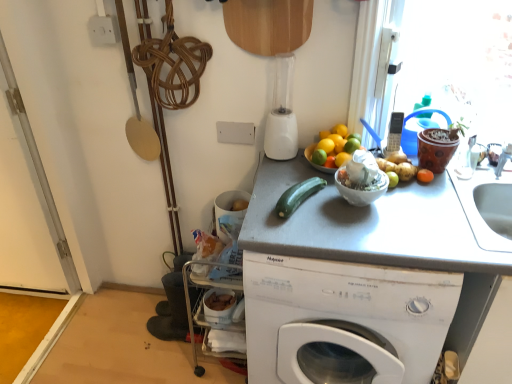
Question: Considering the relative sizes of green matte lime at center, placed as the second lime when sorted from right to left, and orange matte at upper center, marked as the third orange in a bottom-to-top arrangement, in the image provided, is green matte lime at center, placed as the second lime when sorted from right to left, shorter than orange matte at upper center, marked as the third orange in a bottom-to-top arrangement,?

Choices:
 (A) no
 (B) yes

Answer: (A)

Question: Is green matte lime at center, positioned as the 1th lime in left-to-right order, taller than orange matte at upper center, marked as the third orange in a bottom-to-top arrangement?

Choices:
 (A) yes
 (B) no

Answer: (A)

Question: From the image's perspective, is green matte lime at center, placed as the second lime when sorted from right to left, located beneath orange matte at upper center, which is counted as the 1th orange, starting from the top?

Choices:
 (A) no
 (B) yes

Answer: (B)

Question: From a real-world perspective, is green matte lime at center, positioned as the 1th lime in left-to-right order, located beneath orange matte at upper center, which is counted as the 1th orange, starting from the top?

Choices:
 (A) yes
 (B) no

Answer: (A)

Question: Is orange matte at upper center, marked as the third orange in a bottom-to-top arrangement, inside green matte lime at center, placed as the second lime when sorted from right to left?

Choices:
 (A) yes
 (B) no

Answer: (B)

Question: Does green matte lime at center, placed as the second lime when sorted from right to left, touch orange matte at upper center, marked as the third orange in a bottom-to-top arrangement?

Choices:
 (A) no
 (B) yes

Answer: (B)

Question: Considering the relative sizes of orange matte at upper right, which is the second orange from bottom to top, and orange matte at right in the image provided, is orange matte at upper right, which is the second orange from bottom to top, taller than orange matte at right?

Choices:
 (A) no
 (B) yes

Answer: (B)

Question: Does orange matte at upper right, the 2th orange viewed from the top, have a lesser width compared to orange matte at right?

Choices:
 (A) no
 (B) yes

Answer: (B)

Question: From a real-world perspective, is orange matte at upper right, the 2th orange viewed from the top, over orange matte at right?

Choices:
 (A) yes
 (B) no

Answer: (A)

Question: Is orange matte at upper right, which is the second orange from bottom to top, not close to orange matte at right?

Choices:
 (A) yes
 (B) no

Answer: (B)

Question: Is orange matte at upper right, which is the second orange from bottom to top, directly adjacent to orange matte at right?

Choices:
 (A) no
 (B) yes

Answer: (A)

Question: Does orange matte at upper right, which is the second orange from bottom to top, have a smaller size compared to orange matte at right?

Choices:
 (A) no
 (B) yes

Answer: (B)

Question: Considering the relative sizes of white matte washing machine at center and gray matte counter top at center in the image provided, is white matte washing machine at center taller than gray matte counter top at center?

Choices:
 (A) yes
 (B) no

Answer: (B)